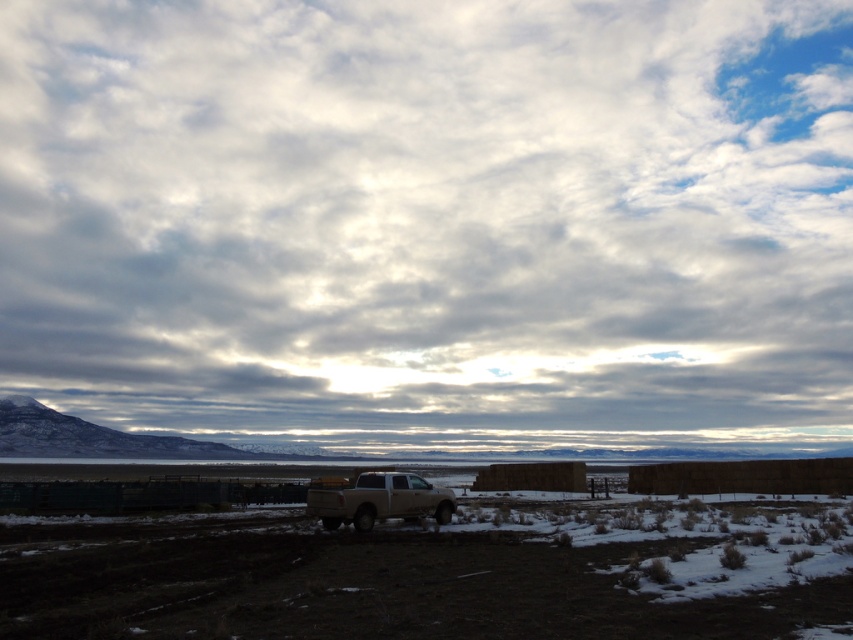
Question: Is cloudy sky at upper center positioned behind matte white truck at center?

Choices:
 (A) no
 (B) yes

Answer: (B)

Question: Does brown dirt field at center appear over matte white truck at center?

Choices:
 (A) no
 (B) yes

Answer: (B)

Question: Which point appears closest to the camera in this image?

Choices:
 (A) (380, 492)
 (B) (846, 321)

Answer: (A)

Question: Which point is closer to the camera?

Choices:
 (A) matte white truck at center
 (B) cloudy sky at upper center
 (C) brown dirt field at center

Answer: (C)

Question: Does brown dirt field at center have a larger size compared to matte white truck at center?

Choices:
 (A) yes
 (B) no

Answer: (A)

Question: Estimate the real-world distances between objects in this image. Which object is farther from the matte white truck at center?

Choices:
 (A) brown dirt field at center
 (B) cloudy sky at upper center

Answer: (B)